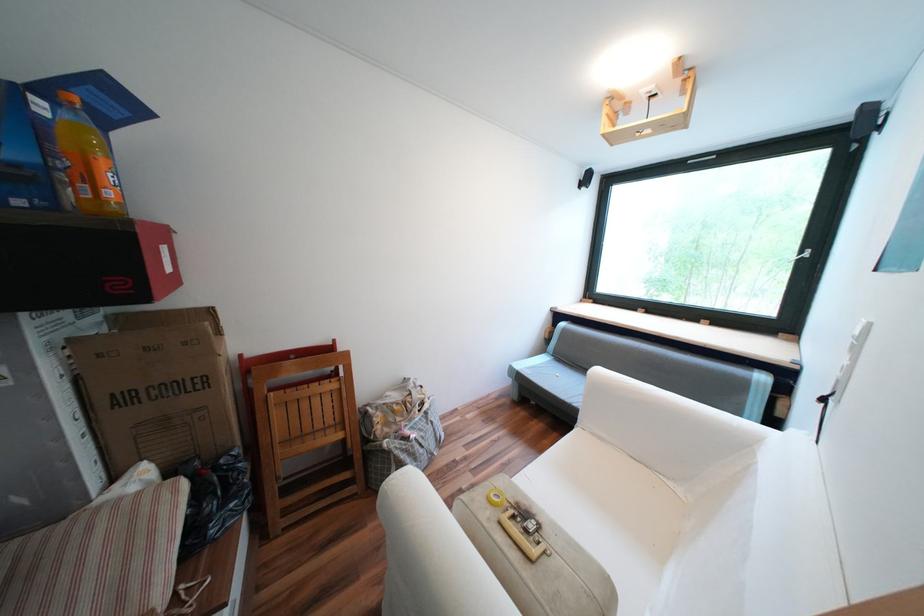
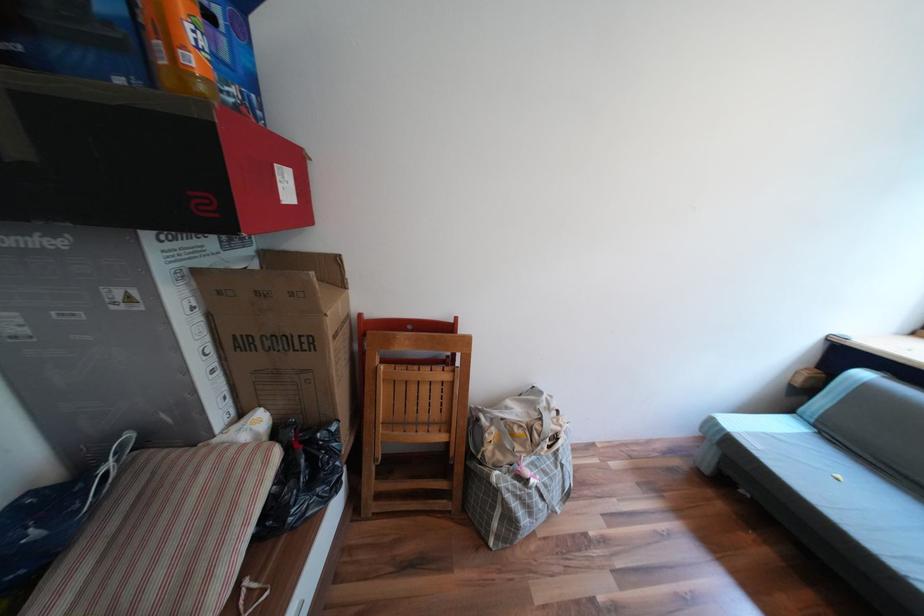
Find the pixel in the second image that matches point 232,461 in the first image.

(327, 435)